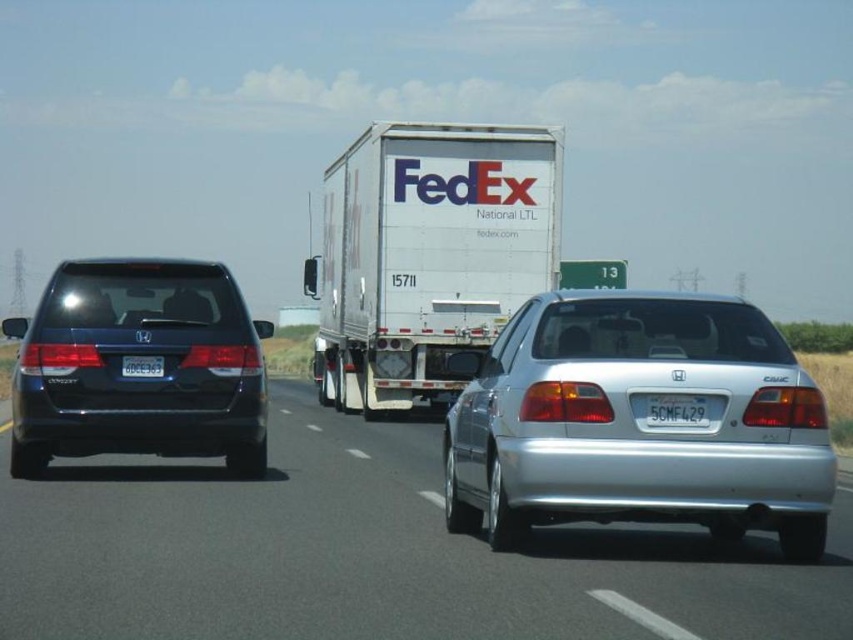
Between silver metallic sedan at center and white plastic license plate at rear left, which one appears on the left side from the viewer's perspective?

white plastic license plate at rear left

Is silver metallic sedan at center to the left of white plastic license plate at rear left from the viewer's perspective?

No, silver metallic sedan at center is not to the left of white plastic license plate at rear left.

From the picture: Who is more forward, (577, 356) or (131, 364)?

Point (577, 356)

I want to click on silver metallic sedan at center, so click(637, 420).

This screenshot has width=853, height=640. Describe the element at coordinates (677, 410) in the screenshot. I see `gray metallic license plate at center` at that location.

Between gray metallic license plate at center and white plastic license plate at rear left, which one has more height?

white plastic license plate at rear left is taller.

Does point (653, 403) come closer to viewer compared to point (125, 371)?

That is True.

Locate an element on the screen. This screenshot has height=640, width=853. gray metallic license plate at center is located at coordinates tap(677, 410).

Is silver metallic car at center smaller than silver metallic sedan at center?

Incorrect, silver metallic car at center is not smaller in size than silver metallic sedan at center.

Is point (410, 560) behind point (651, 474)?

That is True.

Where is `silver metallic car at center`? silver metallic car at center is located at coordinates (368, 554).

Find the location of a particular element. The image size is (853, 640). silver metallic car at center is located at coordinates (368, 554).